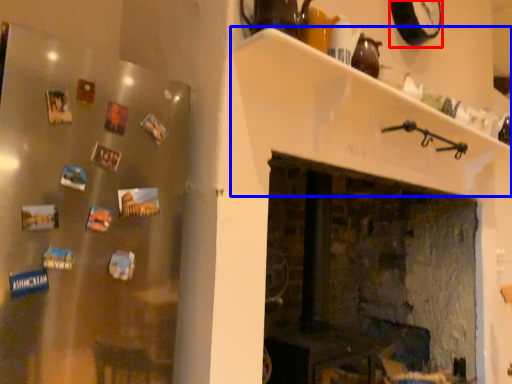
Question: Which point is further to the camera, clock (highlighted by a red box) or shelf (highlighted by a blue box)?

Choices:
 (A) clock
 (B) shelf

Answer: (A)